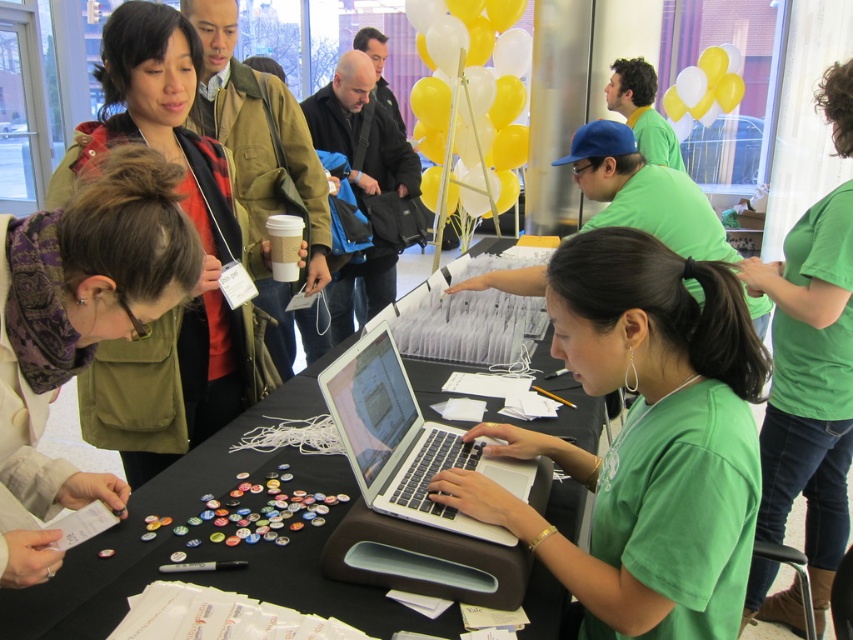
Between yellow matte balloons at upper center and silver metallic laptop at center, which one appears on the right side from the viewer's perspective?

Positioned to the right is yellow matte balloons at upper center.

Can you confirm if yellow matte balloons at upper center is smaller than silver metallic laptop at center?

No.

Where is `yellow matte balloons at upper center`? This screenshot has height=640, width=853. yellow matte balloons at upper center is located at coordinates (471, 99).

Identify the location of yellow matte balloons at upper center. This screenshot has height=640, width=853. (471, 99).

Is black fabric table at center below yellow matte balloons at upper center?

Indeed, black fabric table at center is positioned under yellow matte balloons at upper center.

Does black fabric table at center have a lesser height compared to yellow matte balloons at upper center?

Yes, black fabric table at center is shorter than yellow matte balloons at upper center.

Between point (231, 444) and point (509, 102), which one is positioned behind?

Point (509, 102)

Identify the location of black fabric table at center. (212, 545).

Can you confirm if black fabric table at center is positioned below yellow matte balloons at upper right?

Yes, black fabric table at center is below yellow matte balloons at upper right.

Does black fabric table at center have a greater width compared to yellow matte balloons at upper right?

Indeed, black fabric table at center has a greater width compared to yellow matte balloons at upper right.

Is point (180, 464) positioned behind point (715, 84)?

No, it is in front of (715, 84).

Locate an element on the screen. black fabric table at center is located at coordinates (212, 545).